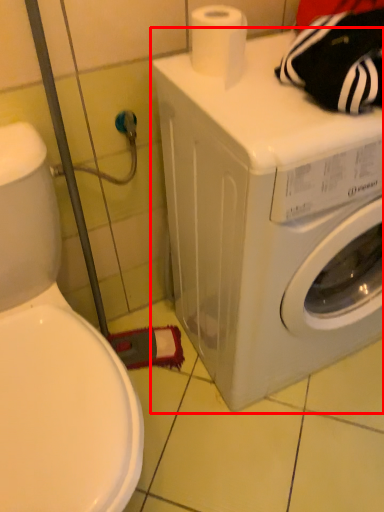
Question: From the image's perspective, what is the correct spatial relationship of washing machine (annotated by the red box) in relation to toilet paper?

Choices:
 (A) above
 (B) below

Answer: (B)